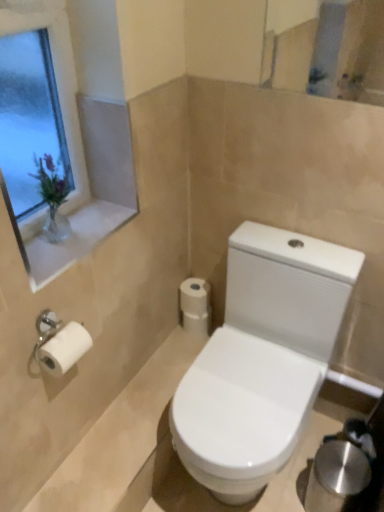
Where is `empty space that is ontop of white glossy toilet at lower center`? empty space that is ontop of white glossy toilet at lower center is located at coordinates (135, 422).